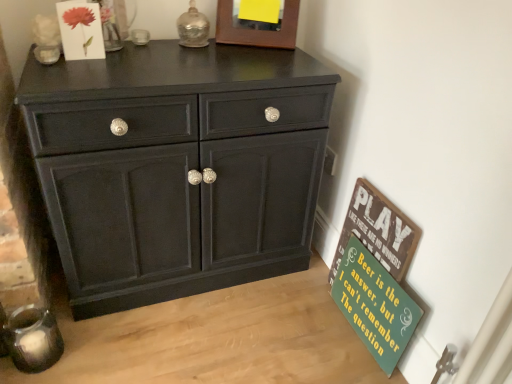
The height and width of the screenshot is (384, 512). Find the location of `vacant area that is in front of matte black cabinet at center`. vacant area that is in front of matte black cabinet at center is located at coordinates (181, 341).